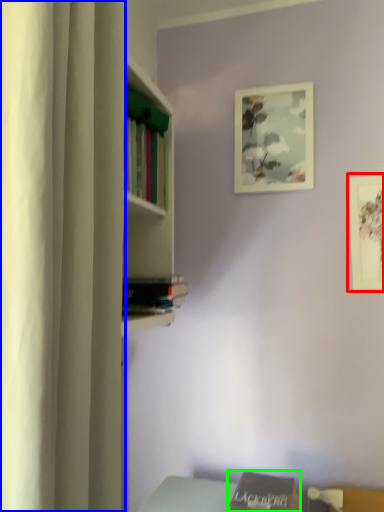
Question: Which object is the farthest from picture frame (highlighted by a red box)? Choose among these: curtain (highlighted by a blue box) or book (highlighted by a green box).

Choices:
 (A) curtain
 (B) book

Answer: (A)